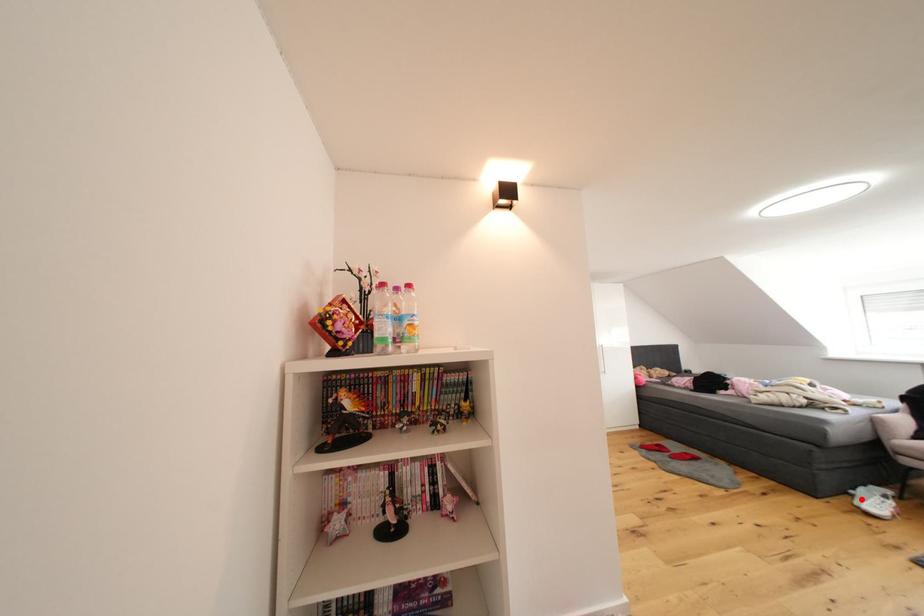
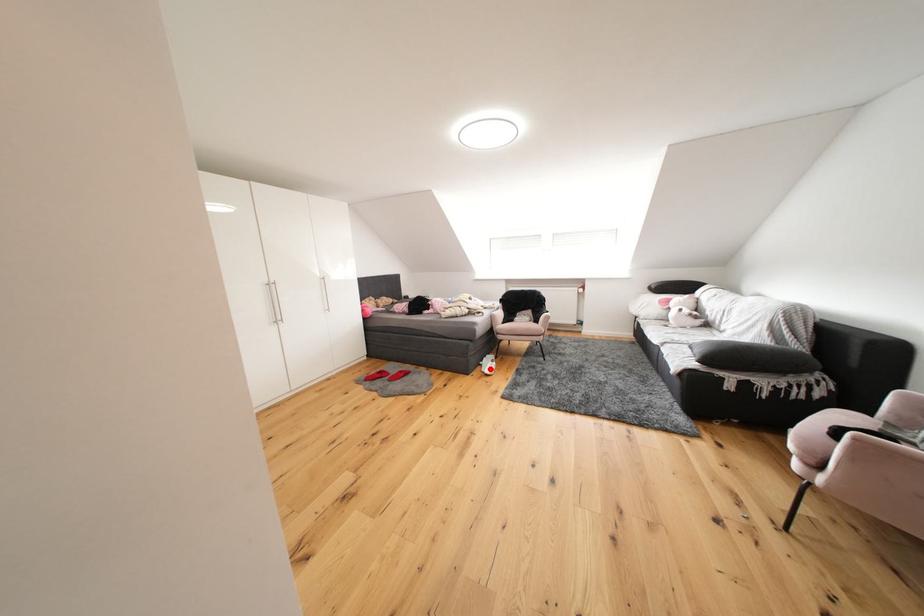
I am providing you with two images of the same scene from different viewpoints. A red point is marked on the first image and another point is marked on the second image. Do the highlighted points in image1 and image2 indicate the same real-world spot?

Yes